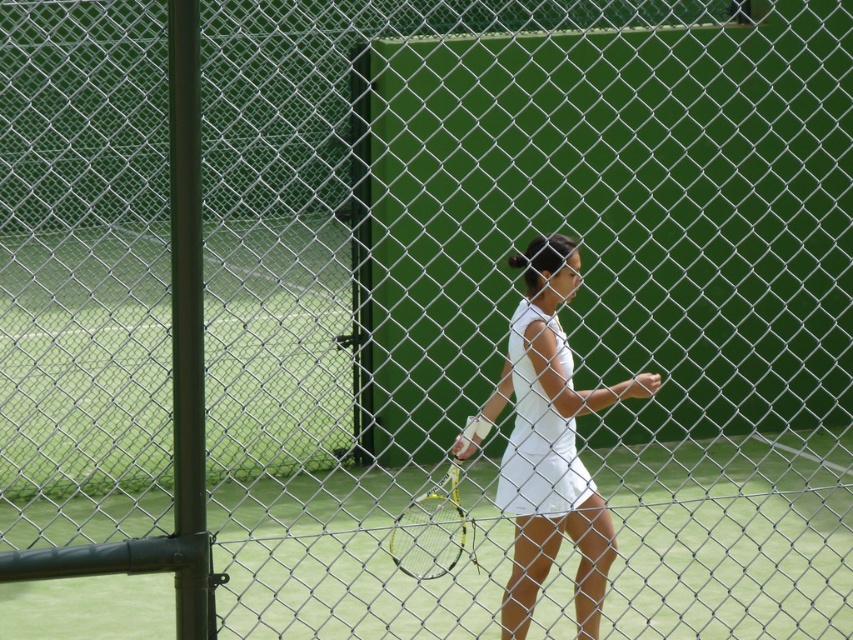
Question: Does white matte dress at center appear on the right side of green metallic racket at center?

Choices:
 (A) yes
 (B) no

Answer: (A)

Question: Can you confirm if white matte tennis dress at center is positioned to the left of white matte dress at center?

Choices:
 (A) no
 (B) yes

Answer: (B)

Question: Which of the following is the farthest from the observer?

Choices:
 (A) white matte dress at center
 (B) green metallic racket at center

Answer: (A)

Question: Does white matte tennis dress at center appear on the left side of green metallic racket at center?

Choices:
 (A) no
 (B) yes

Answer: (A)

Question: Based on their relative distances, which object is nearer to the white matte dress at center?

Choices:
 (A) green metallic racket at center
 (B) white matte tennis dress at center

Answer: (B)

Question: Which is farther from the green metallic racket at center?

Choices:
 (A) white matte dress at center
 (B) white matte tennis dress at center

Answer: (A)